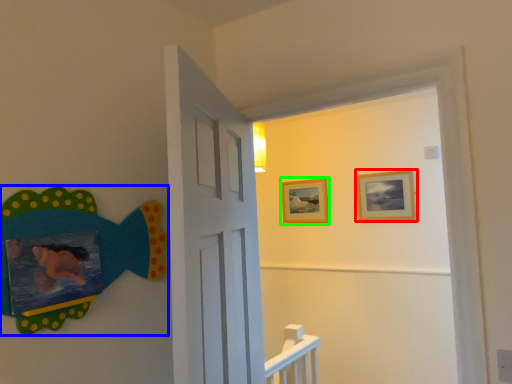
Question: Considering the real-world distances, which object is closest to picture frame (highlighted by a red box)? art (highlighted by a blue box) or picture frame (highlighted by a green box).

Choices:
 (A) art
 (B) picture frame

Answer: (B)